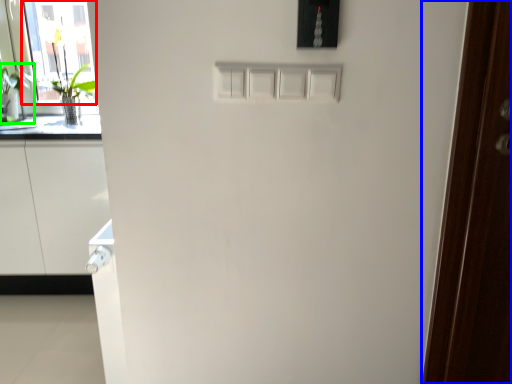
Question: Based on their relative distances, which object is farther from glass door (highlighted by a red box)? Choose from door (highlighted by a blue box) and plant (highlighted by a green box).

Choices:
 (A) door
 (B) plant

Answer: (A)